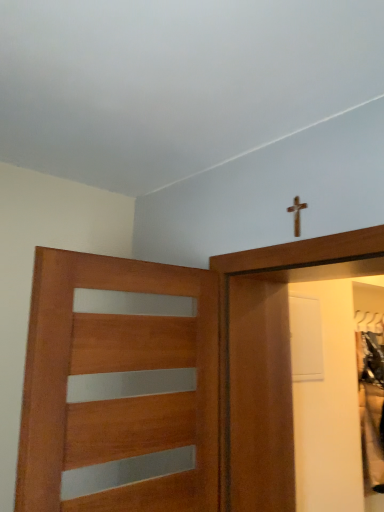
Question: Considering the positions of wooden door with frosted glass panels at left and wooden cross at upper center in the image, is wooden door with frosted glass panels at left taller or shorter than wooden cross at upper center?

Choices:
 (A) tall
 (B) short

Answer: (A)

Question: From a real-world perspective, relative to wooden cross at upper center, is wooden door with frosted glass panels at left vertically above or below?

Choices:
 (A) above
 (B) below

Answer: (B)

Question: Is point (279, 442) closer or farther from the camera than point (294, 212)?

Choices:
 (A) farther
 (B) closer

Answer: (A)

Question: In terms of height, does wooden cross at upper center look taller or shorter compared to wooden door with frosted glass panels at left?

Choices:
 (A) tall
 (B) short

Answer: (B)

Question: In the image, is wooden cross at upper center positioned in front of or behind wooden door with frosted glass panels at left?

Choices:
 (A) front
 (B) behind

Answer: (B)

Question: Considering the positions of wooden cross at upper center and wooden door with frosted glass panels at left in the image, is wooden cross at upper center wider or thinner than wooden door with frosted glass panels at left?

Choices:
 (A) wide
 (B) thin

Answer: (B)

Question: Based on their positions, is wooden cross at upper center located to the left or right of wooden door with frosted glass panels at left?

Choices:
 (A) right
 (B) left

Answer: (A)